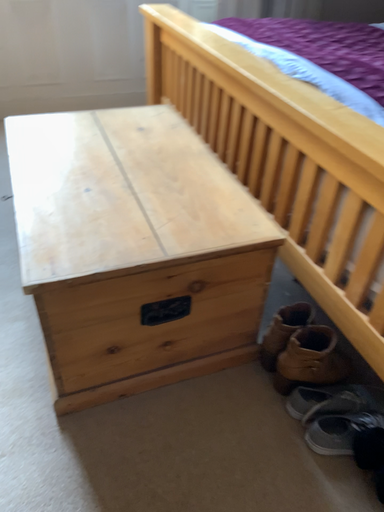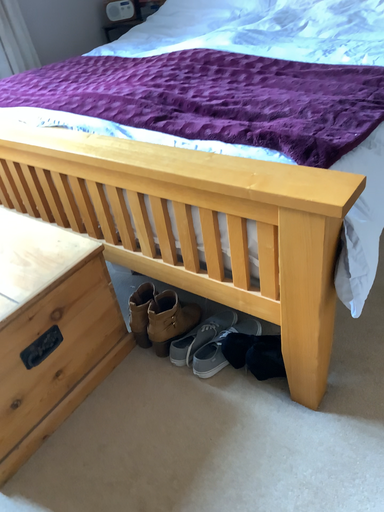
Question: How did the camera likely rotate when shooting the video?

Choices:
 (A) rotated downward
 (B) rotated upward

Answer: (B)